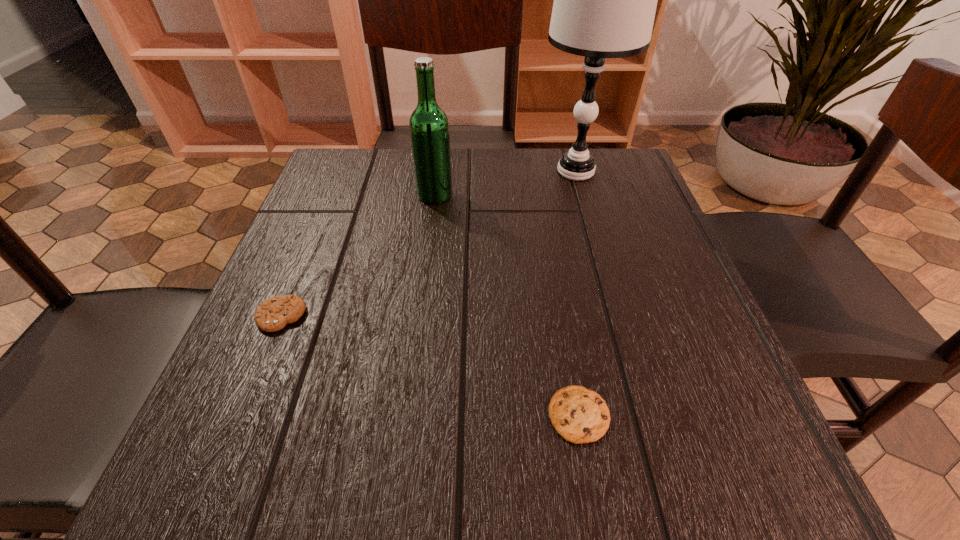
Locate an element on the screen. free location at the right edge is located at coordinates (636, 233).

In the image, there is a desktop. Identify the location of vacant region at the far left corner. The image size is (960, 540). (348, 173).

The height and width of the screenshot is (540, 960). Identify the location of vacant region at the near left corner of the desktop. (293, 495).

Where is `free spot at the far right corner of the desktop`? The width and height of the screenshot is (960, 540). free spot at the far right corner of the desktop is located at coordinates (612, 150).

This screenshot has width=960, height=540. I want to click on vacant point located between the second tallest object and the table lamp, so click(505, 183).

At what (x,y) coordinates should I click in order to perform the action: click on free space between the table lamp and the third shortest object. Please return your answer as a coordinate pair (x, y). The image size is (960, 540). Looking at the image, I should click on (505, 183).

At what (x,y) coordinates should I click in order to perform the action: click on vacant area that lies between the tallest object and the taller cookie. Please return your answer as a coordinate pair (x, y). Looking at the image, I should click on (428, 244).

Where is `vacant area between the nearer cookie and the leftmost object`? The image size is (960, 540). vacant area between the nearer cookie and the leftmost object is located at coordinates (430, 366).

Identify the location of empty space that is in between the shorter cookie and the third farthest object. (430, 366).

Find the location of a particular element. This screenshot has width=960, height=540. vacant space that's between the beer bottle and the shortest object is located at coordinates (507, 305).